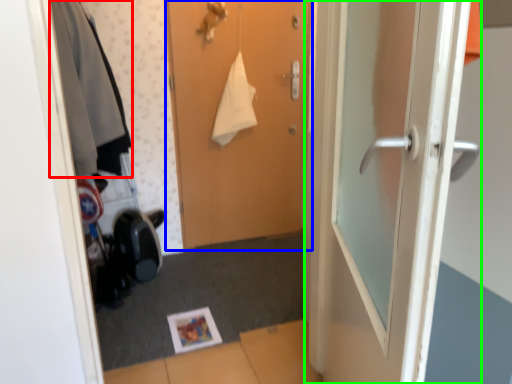
Question: Based on their relative distances, which object is farther from clothing (highlighted by a red box)? Choose from door (highlighted by a blue box) and door (highlighted by a green box).

Choices:
 (A) door
 (B) door

Answer: (B)